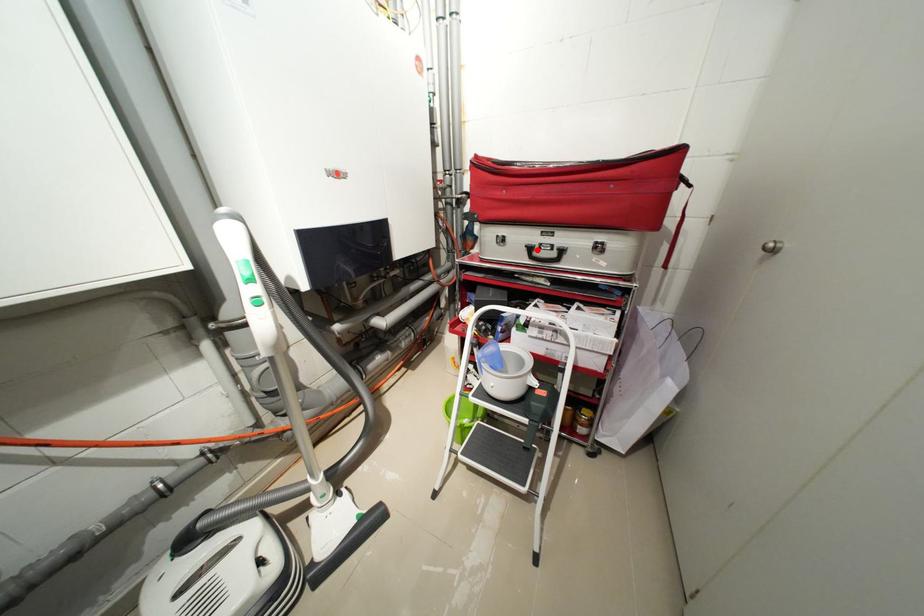
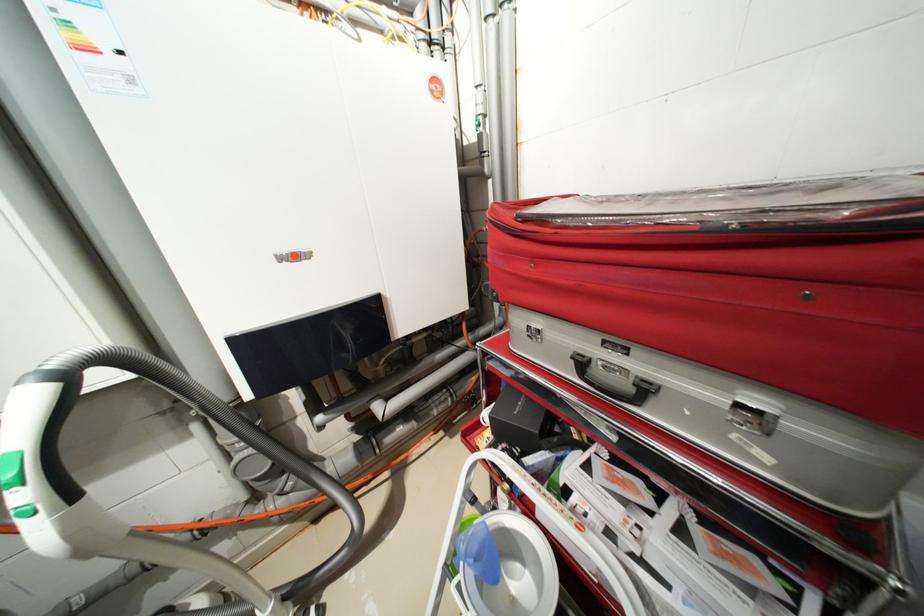
Find the pixel in the second image that matches the highlighted location in the first image.

(589, 363)